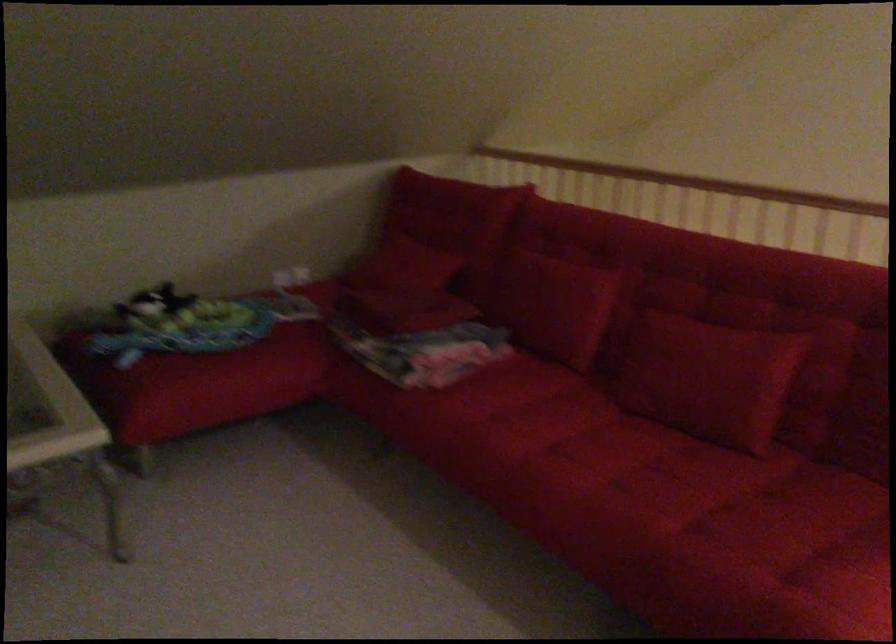
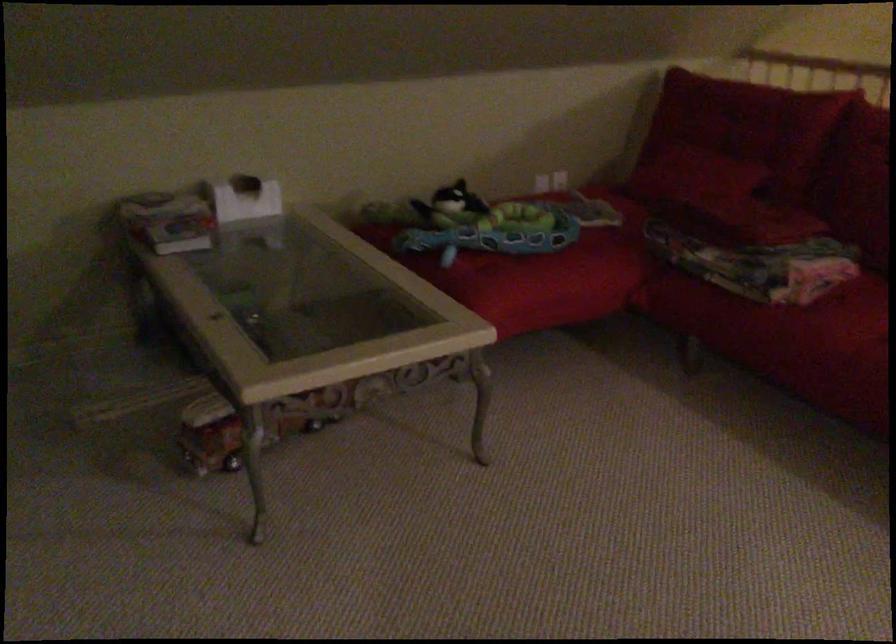
In the second image, find the point that corresponds to point 185,335 in the first image.

(495, 232)